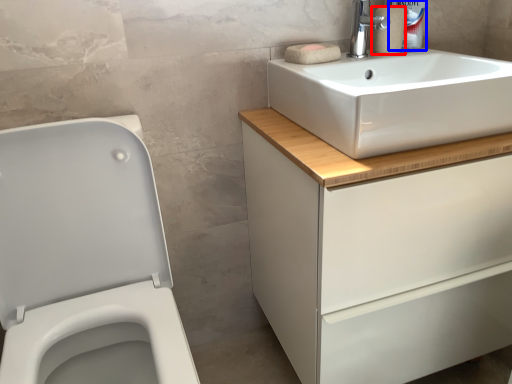
Question: Which object appears closest to the camera in this image, toilet paper (highlighted by a red box) or cleaning product (highlighted by a blue box)?

Choices:
 (A) toilet paper
 (B) cleaning product

Answer: (A)